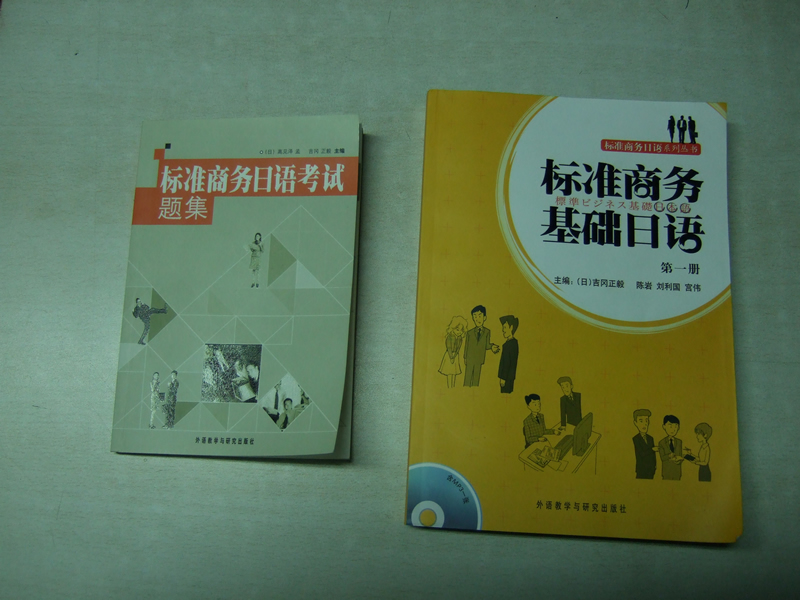
This screenshot has width=800, height=600. Identify the location of smaller book. click(230, 296).